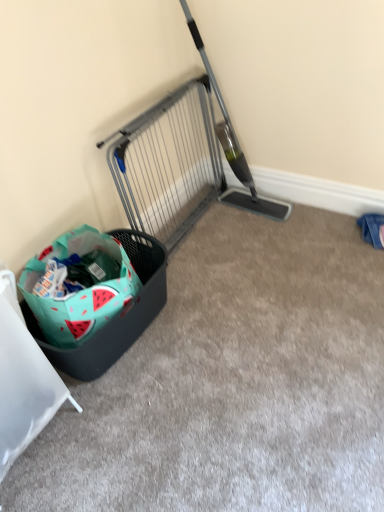
Question: From the image's perspective, is metallic gray gate at upper center positioned above or below teal fabric basket at lower left?

Choices:
 (A) below
 (B) above

Answer: (B)

Question: From their relative heights in the image, would you say metallic gray gate at upper center is taller or shorter than teal fabric basket at lower left?

Choices:
 (A) tall
 (B) short

Answer: (B)

Question: Considering the real-world distances, which object is farthest from the watermelon-patterned fabric shopping bag at lower left?

Choices:
 (A) teal fabric basket at lower left
 (B) metallic gray gate at upper center

Answer: (B)

Question: Which object is positioned closest to the teal fabric basket at lower left?

Choices:
 (A) metallic gray gate at upper center
 (B) watermelon-patterned fabric shopping bag at lower left

Answer: (B)